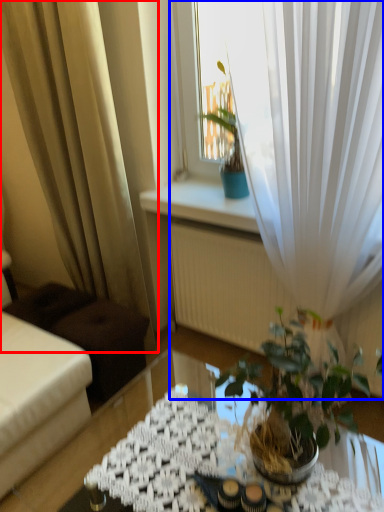
Question: Which of the following is the farthest to the observer, curtain (highlighted by a red box) or curtain (highlighted by a blue box)?

Choices:
 (A) curtain
 (B) curtain

Answer: (A)